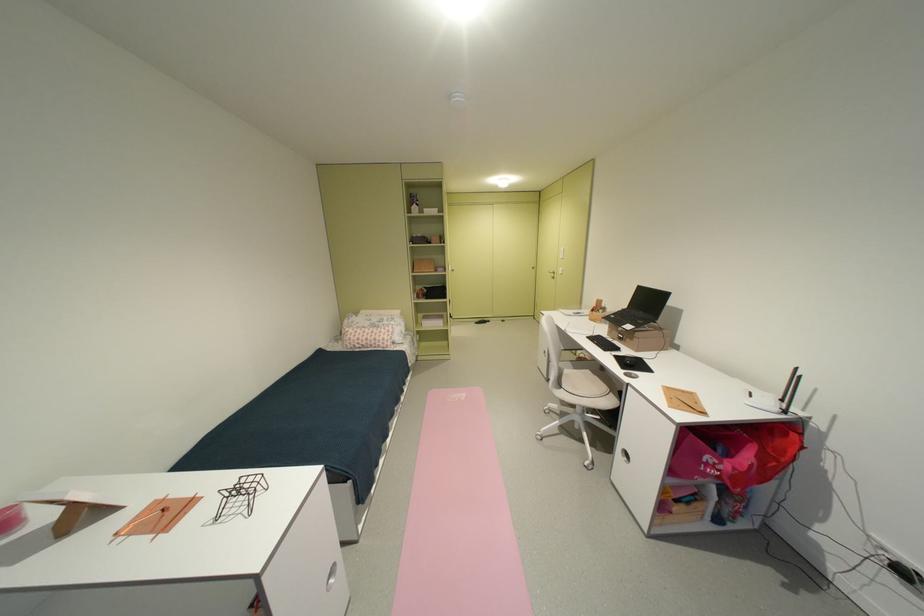
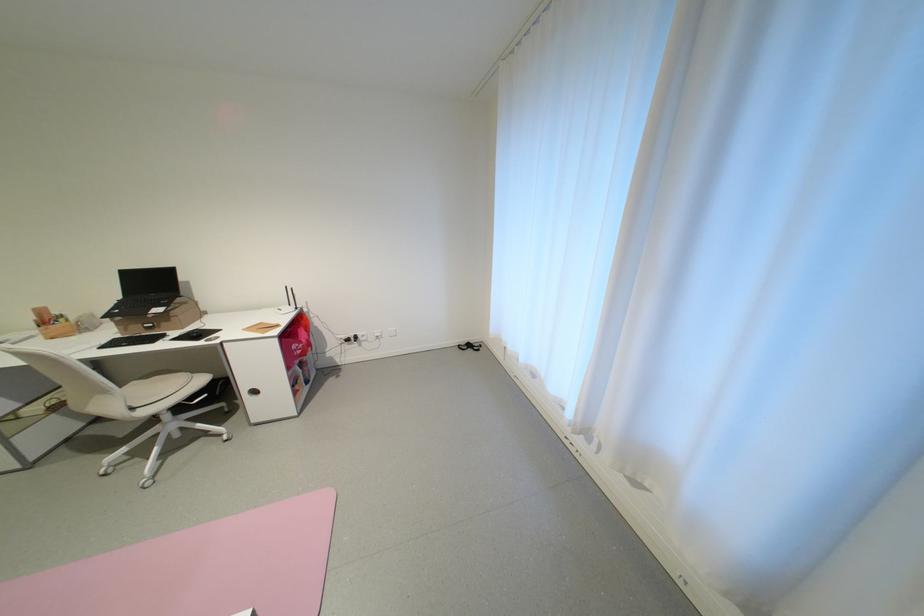
Based on the continuous images, in which direction is the camera rotating?

The camera rotated toward right-down.